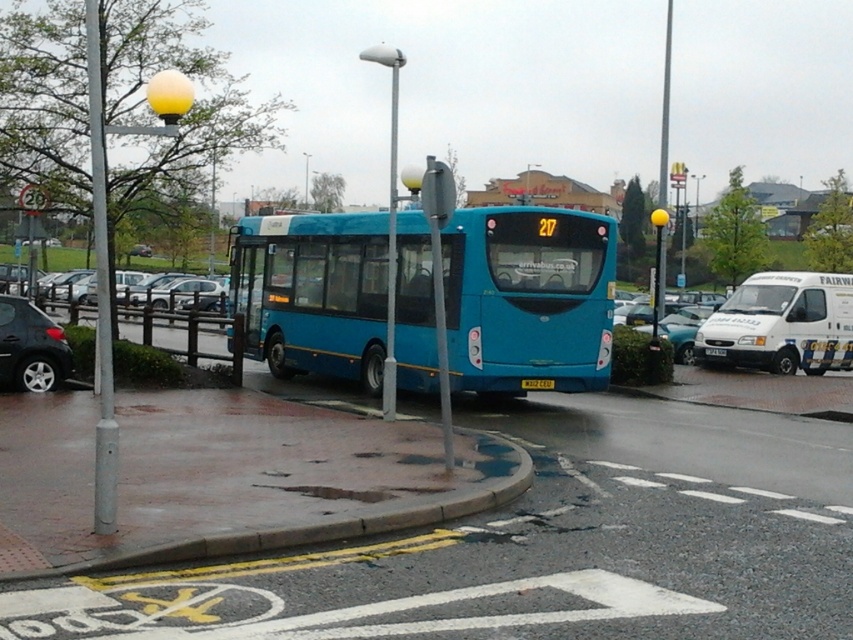
You are a pedestrian standing at the bus stop. You need to walk to the yellow plastic license plate at center. Which direction should you walk from the yellow matte license plate at center?

The yellow plastic license plate at center is 8.82 meters away from the yellow matte license plate at center. Since the distance is quite far, you should walk straight ahead from the yellow matte license plate at center towards the yellow plastic license plate at center to reach it.

You are a bus driver who just arrived at the bus stop. You need to check the license plates to ensure they are correctly displayed. Which license plate, the yellow matte license plate at center or the yellow plastic license plate at center, is smaller in size?

The yellow matte license plate at center has a smaller size compared to the yellow plastic license plate at center, so the yellow matte license plate at center is the smaller one.